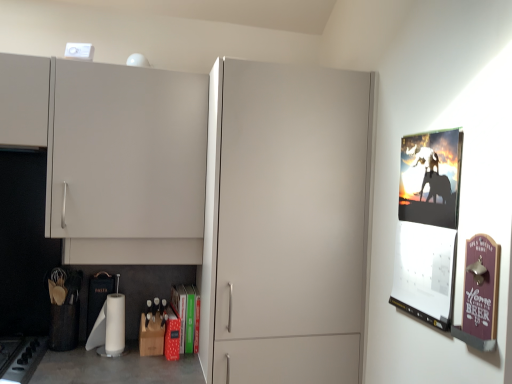
Question: Which is correct: white matte toilet paper at lower center is inside matte white cabinet at center, or outside of it?

Choices:
 (A) outside
 (B) inside

Answer: (A)

Question: Considering the positions of white matte toilet paper at lower center and matte white cabinet at center in the image, is white matte toilet paper at lower center taller or shorter than matte white cabinet at center?

Choices:
 (A) tall
 (B) short

Answer: (B)

Question: Which object is positioned farthest from the purple wood sign at right, the first poster page viewed from the front?

Choices:
 (A) white matte toilet paper at lower center
 (B) matte white cabinet at upper left
 (C) matte white cabinet at center
 (D) silhouette paper poster at right, positioned as the 1th poster page in back-to-front order
 (E) green matte book at lower center

Answer: (A)

Question: Estimate the real-world distances between objects in this image. Which object is farther from the white matte toilet paper at lower center?

Choices:
 (A) green matte book at lower center
 (B) matte white cabinet at upper left
 (C) matte white cabinet at center
 (D) purple wood sign at right, the first poster page viewed from the front
 (E) black matte gas stove at lower left

Answer: (D)